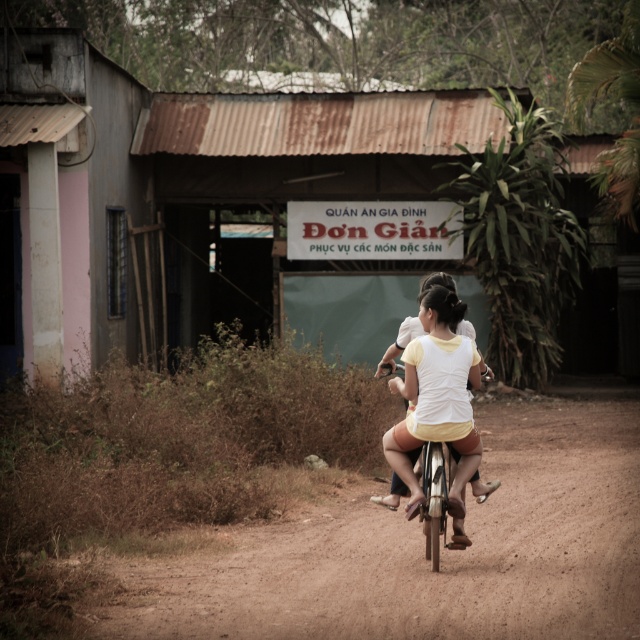
You are a photographer standing in front of the small building with a rusted corrugated metal roof. You want to take a photo of the two cyclists riding along the dirt road. Which point, point (76, 163) or point (464, 387), is closer to your camera?

Point (76, 163) is further to the camera than point (464, 387), so the closer point to your camera is point (464, 387).

You are a cyclist riding a bicycle and you see the rusty metal hut at center and the white matte shirt at center. Which object is closer to you?

The white matte shirt at center is closer to you because the rusty metal hut at center is further away.